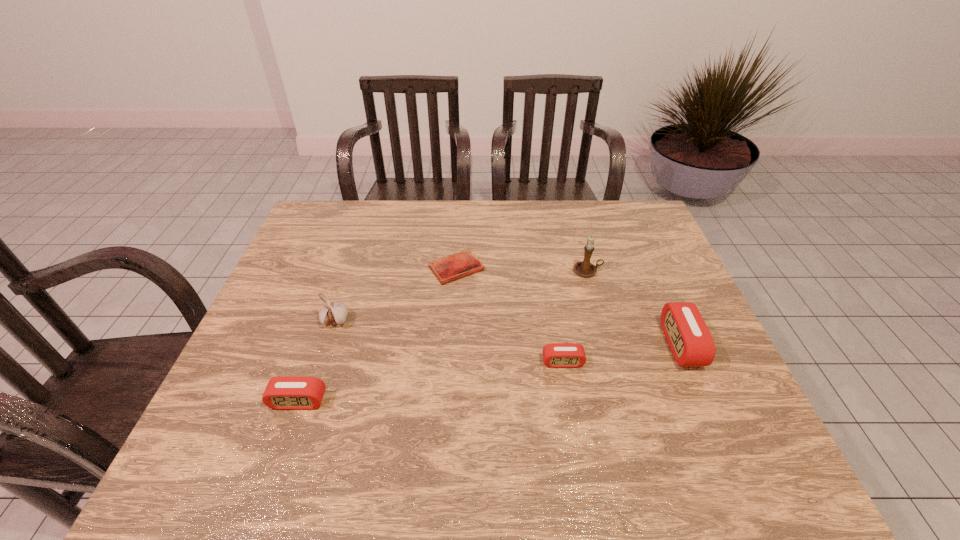
You are a GUI agent. You are given a task and a screenshot of the screen. Output one action in this format:
    pyautogui.click(x=<x>, y=<y>)
    Task: Click on the third closest alarm clock to the fourth object from right to left
    This screenshot has height=540, width=960.
    Given the screenshot: What is the action you would take?
    pyautogui.click(x=690, y=341)

Locate an element on the screen. This screenshot has width=960, height=540. blank area in the image that satisfies the following two spatial constraints: 1. on the front-facing side of the rightmost object; 2. on the front-facing side of the second shortest alarm clock is located at coordinates (706, 401).

I want to click on vacant region that satisfies the following two spatial constraints: 1. on the front-facing side of the rightmost alarm clock; 2. on the front-facing side of the nearest object, so click(706, 401).